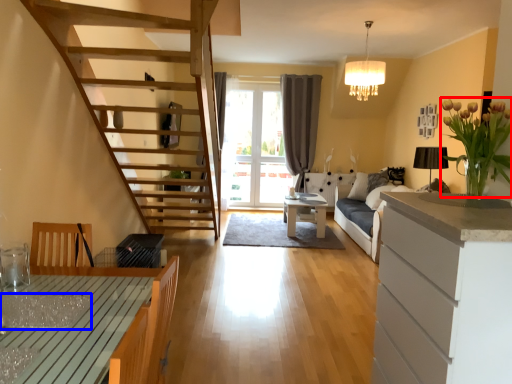
Question: Which of the following is the farthest to the observer, flower (highlighted by a red box) or glass table (highlighted by a blue box)?

Choices:
 (A) flower
 (B) glass table

Answer: (A)